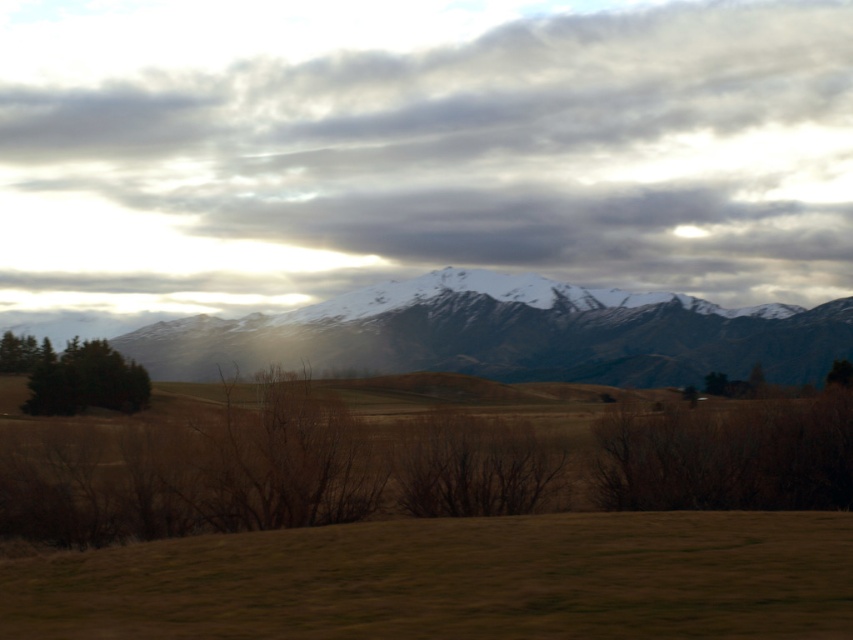
Is cloudy sky at upper center to the left of snowy mountain range at center from the viewer's perspective?

Correct, you'll find cloudy sky at upper center to the left of snowy mountain range at center.

Does point (538, 244) come in front of point (434, 316)?

That is False.

Find the location of a particular element. The image size is (853, 640). cloudy sky at upper center is located at coordinates (419, 148).

Find the location of `cloudy sky at upper center`. cloudy sky at upper center is located at coordinates pyautogui.click(x=419, y=148).

The width and height of the screenshot is (853, 640). Describe the element at coordinates (456, 579) in the screenshot. I see `brown grass at lower center` at that location.

Is point (576, 538) more distant than point (595, 352)?

No, (576, 538) is closer to viewer.

Where is `brown grass at lower center`? This screenshot has height=640, width=853. brown grass at lower center is located at coordinates (456, 579).

Is point (335, 600) behind point (51, 408)?

No, (335, 600) is in front of (51, 408).

At what (x,y) coordinates should I click in order to perform the action: click on brown grass at lower center. Please return your answer as a coordinate pair (x, y). Looking at the image, I should click on pyautogui.click(x=456, y=579).